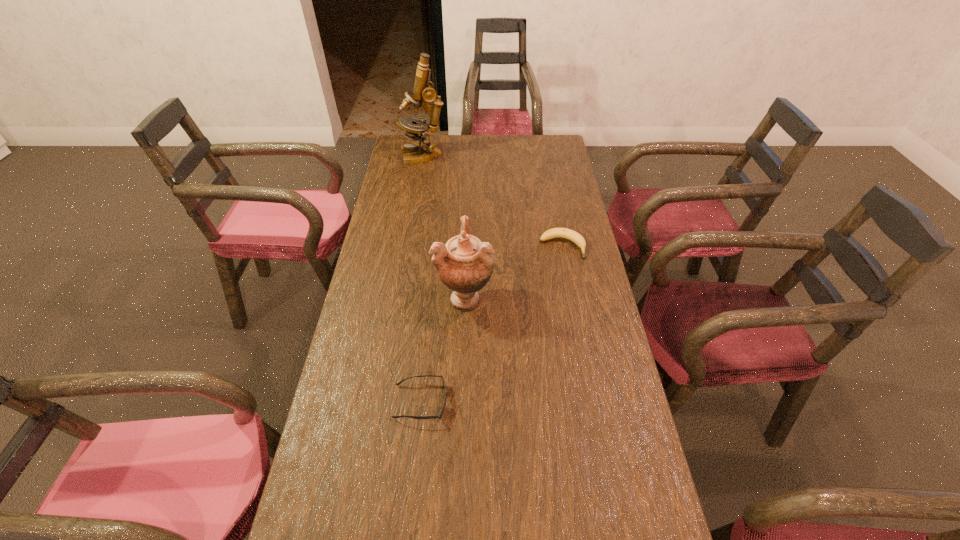
The width and height of the screenshot is (960, 540). What are the coordinates of `the tallest object` in the screenshot? It's located at (423, 92).

This screenshot has height=540, width=960. I want to click on the farthest object, so tap(423, 92).

Find the location of a particular element. The width and height of the screenshot is (960, 540). the second nearest object is located at coordinates (464, 264).

The image size is (960, 540). I want to click on the third shortest object, so click(464, 264).

Locate an element on the screen. Image resolution: width=960 pixels, height=540 pixels. the third nearest object is located at coordinates (576, 238).

Identify the location of the rightmost object. The height and width of the screenshot is (540, 960). (576, 238).

At what (x,y) coordinates should I click in order to perform the action: click on the nearest object. Please return your answer as a coordinate pair (x, y). The width and height of the screenshot is (960, 540). Looking at the image, I should click on (440, 415).

You are a GUI agent. You are given a task and a screenshot of the screen. Output one action in this format:
    pyautogui.click(x=<x>, y=<y>)
    Task: Click on the free space located on the back of the tallest object
    This screenshot has width=960, height=540.
    Given the screenshot: What is the action you would take?
    pyautogui.click(x=426, y=138)

Find the location of `vacant space located 0.310m on the front of the second tallest object`. vacant space located 0.310m on the front of the second tallest object is located at coordinates (461, 423).

Identify the location of free space located on the left of the rightmost object. (454, 247).